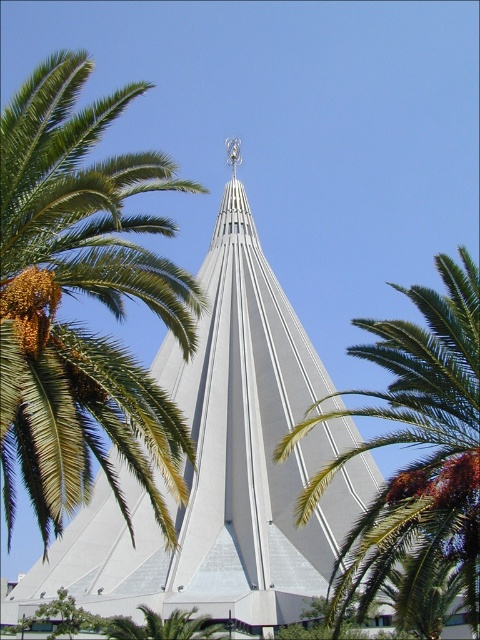
Does white smooth cone at center appear over green leafy palm tree at center?

Indeed, white smooth cone at center is positioned over green leafy palm tree at center.

Is white smooth cone at center below green leafy palm tree at center?

Incorrect, white smooth cone at center is not positioned below green leafy palm tree at center.

Is point (172, 552) farther from viewer compared to point (417, 545)?

Yes.

At what (x,y) coordinates should I click in order to perform the action: click on white smooth cone at center. Please return your answer as a coordinate pair (x, y). Image resolution: width=480 pixels, height=640 pixels. Looking at the image, I should click on click(x=222, y=465).

Is white smooth cone at center to the left of green leafy palm tree at upper left from the viewer's perspective?

Incorrect, white smooth cone at center is not on the left side of green leafy palm tree at upper left.

Can you confirm if white smooth cone at center is wider than green leafy palm tree at upper left?

In fact, white smooth cone at center might be narrower than green leafy palm tree at upper left.

I want to click on white smooth cone at center, so click(222, 465).

From the picture: Measure the distance between point [48,260] and camera.

Point [48,260] is 48.50 meters from camera.

Is green leafy palm tree at upper left positioned in front of green leafy palm tree at center?

Yes.

Is point (27, 488) more distant than point (312, 477)?

No.

Identify the location of green leafy palm tree at upper left. (83, 292).